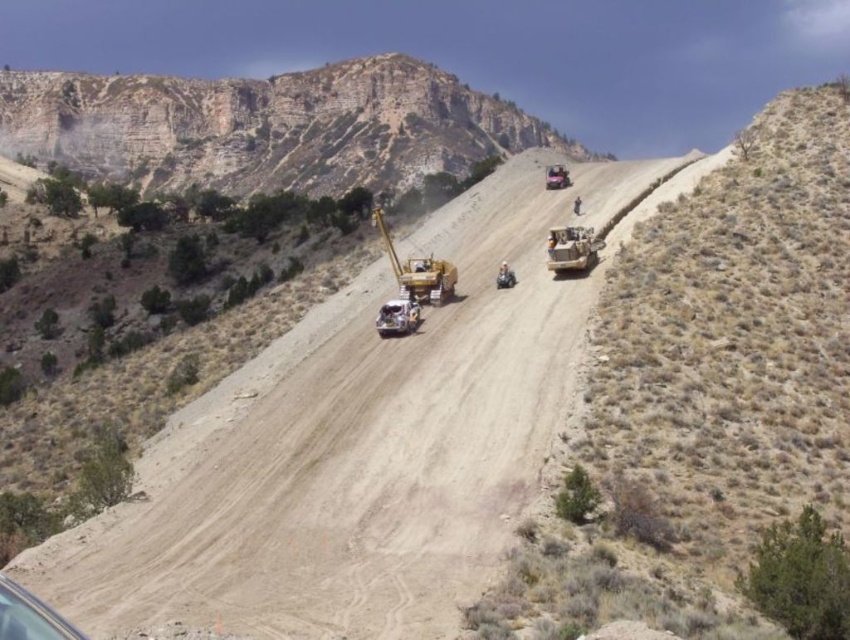
Question: Considering the real-world distances, which object is farthest from the rugged stone cliff at upper left?

Choices:
 (A) transparent plastic car at lower left
 (B) metallic yellow bulldozer at center
 (C) dirt road at center
 (D) yellow rubber tracked vehicle at center

Answer: (A)

Question: Where is dirt road at center located in relation to transparent plastic car at lower left in the image?

Choices:
 (A) above
 (B) below

Answer: (A)

Question: Among these objects, which one is farthest from the camera?

Choices:
 (A) dirt road at center
 (B) transparent plastic car at lower left

Answer: (A)

Question: Can you confirm if metallic yellow bulldozer at center is positioned below metallic yellow truck at center?

Choices:
 (A) no
 (B) yes

Answer: (B)

Question: Is transparent plastic car at lower left smaller than metallic yellow truck at center?

Choices:
 (A) no
 (B) yes

Answer: (B)

Question: Which point is closer to the camera?

Choices:
 (A) (401, 289)
 (B) (564, 236)
 (C) (29, 628)

Answer: (C)